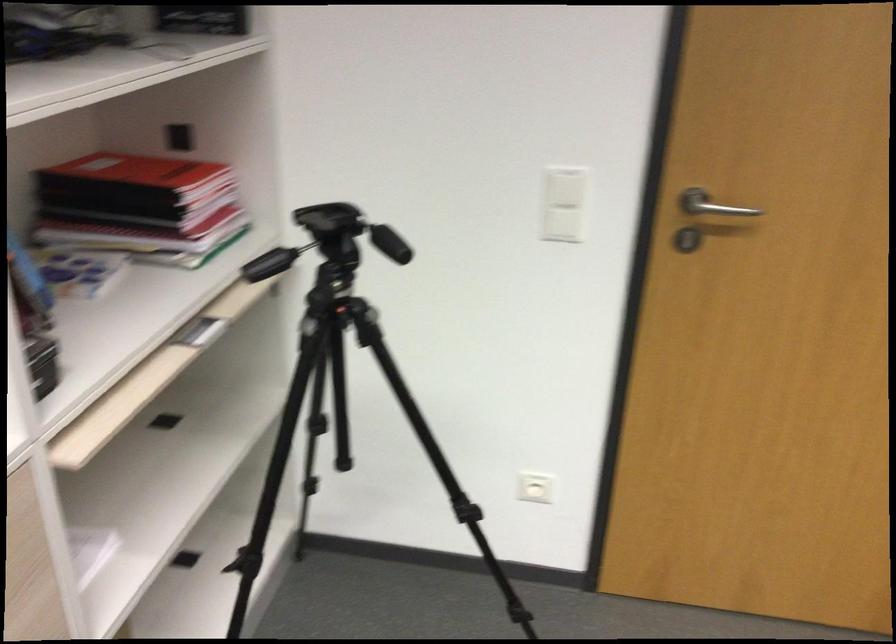
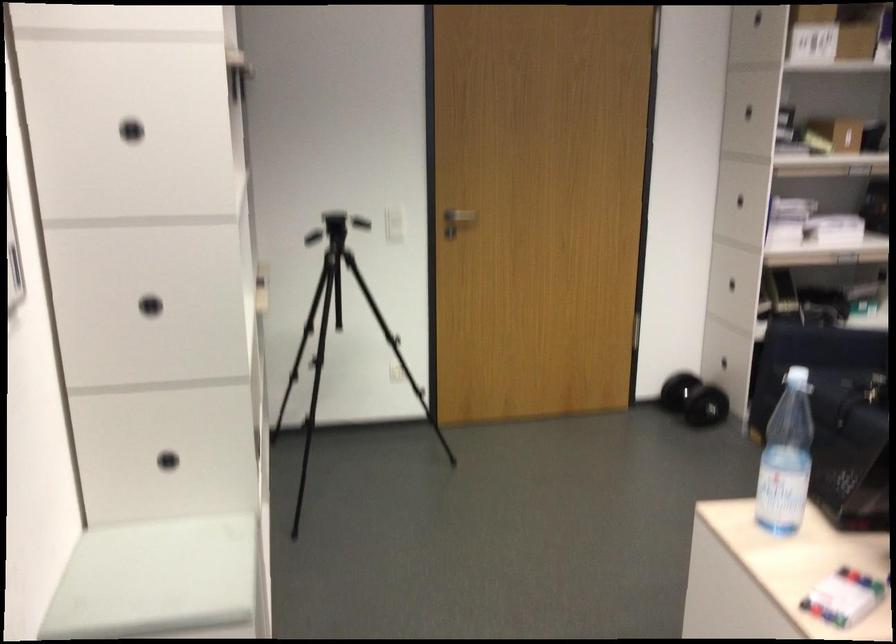
Question: I am providing you with two images of the same scene from different viewpoints. Which of the following objects are not visible in image2?

Choices:
 (A) white light switch
 (B) tripod leg lock
 (C) mug handle
 (D) black dumbbell

Answer: (B)